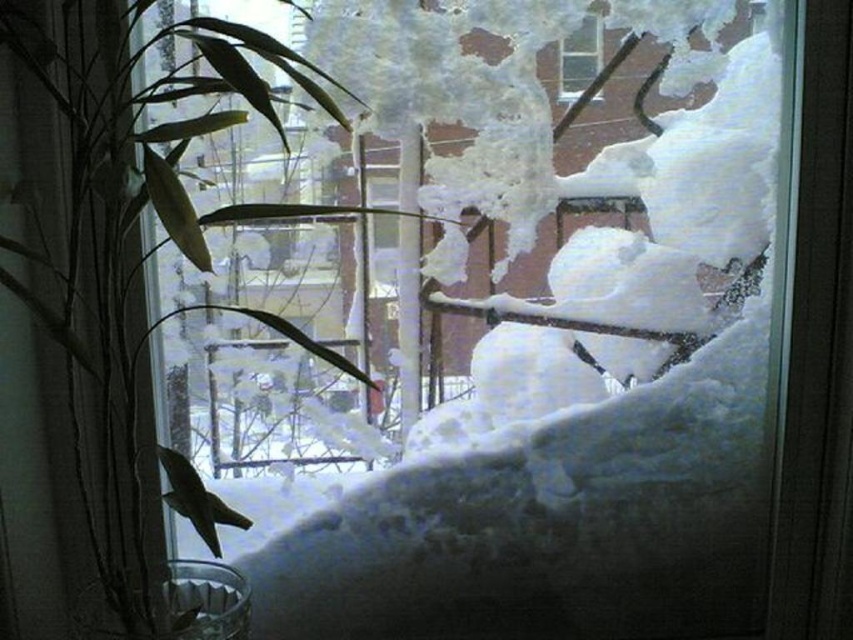
You are trying to see the snow outside through the clear glass window at upper center. However, there is a green leafy plant at left blocking your view. Can you still see the snow outside through the window?

The green leafy plant at left is in front of the clear glass window at upper center, so it blocks your view. You cannot see the snow outside through the window.

You are an interior designer assessing the space in the image. You need to determine if the green leafy plant at left can be placed horizontally on the clear glass window at upper center without exceeding its width. Can it fit?

The green leafy plant at left is wider than the clear glass window at upper center, so placing it horizontally would cause it to exceed the window width and not fit properly.

You are trying to see the snow outside through the clear glass window at upper center. Is the green leafy plant at left blocking your view of the snow?

The green leafy plant at left is located below the clear glass window at upper center, so it is not blocking your view of the snow outside.